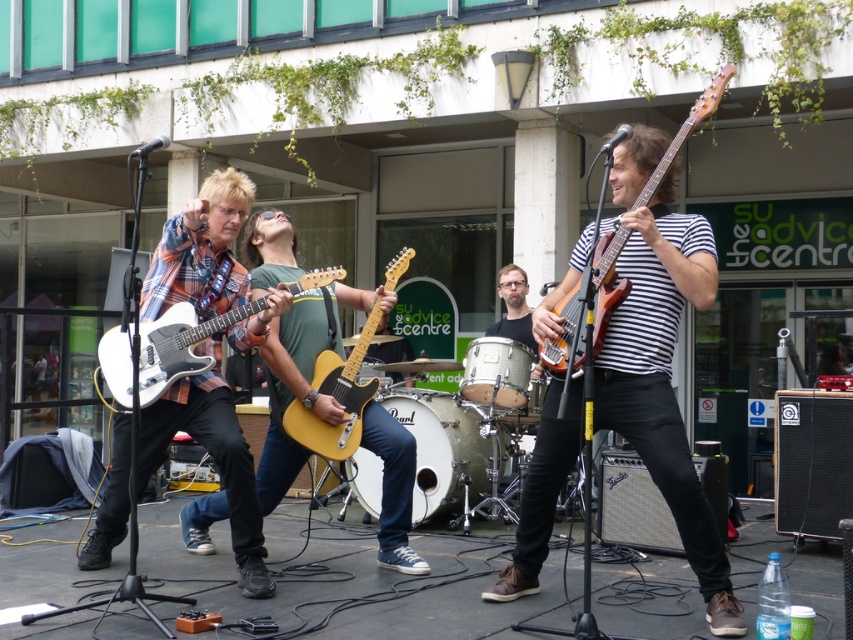
You are standing in the audience watching the band perform. You want to toss a flower to the musician playing the matte white guitar at center. If you can throw a flower up to 15 feet, will you be able to reach them?

The distance between the matte white guitar at center and the viewer is 14.23 feet. Since the viewer can throw up to 15 feet, they can successfully reach the musician playing the matte white guitar at center.

You are a music student who just arrived at the SU advice centre and noticed two guitars on stage. The matte white guitar at center and the matte brown electric guitar at right. Which guitar is wider?

The matte white guitar at center is wider than the matte brown electric guitar at right.

Consider the image. You are a photographer trying to capture a clear shot of both the striped fabric guitar at center and the plaid fabric shirt at left. Since you can only focus on one object at a time, which one should you focus on to ensure the other remains in the background?

You should focus on the plaid fabric shirt at left because the striped fabric guitar at center is positioned to its right, meaning the guitar is further away from the camera. By focusing on the closer object, the background object will still be in focus.